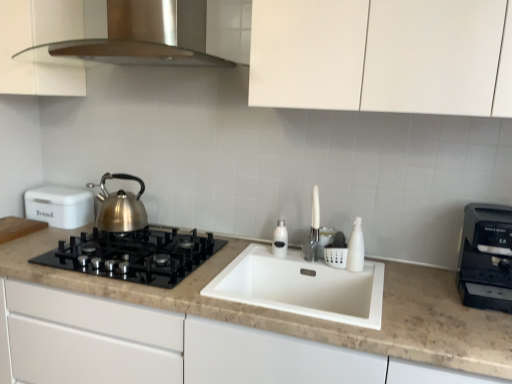
Question: Considering the positions of satin silver soap dispenser at sink, acting as the 2th bottle starting from the front, and black glass gas stove at left in the image, is satin silver soap dispenser at sink, acting as the 2th bottle starting from the front, bigger or smaller than black glass gas stove at left?

Choices:
 (A) small
 (B) big

Answer: (A)

Question: Is point (273, 251) closer or farther from the camera than point (95, 248)?

Choices:
 (A) closer
 (B) farther

Answer: (B)

Question: Which is nearer to the white matte bread bin at left, the first kitchen appliance from the back?

Choices:
 (A) satin silver range hood at upper center
 (B) brushed metal kettle at left
 (C) satin silver soap dispenser at sink, acting as the 2th bottle starting from the front
 (D) black glass gas stove at left
 (E) white plastic bottle at sink, the 1th bottle when ordered from right to left

Answer: (B)

Question: Which is farther from the white plastic bottle at sink, which ranks as the 1th bottle in front-to-back order?

Choices:
 (A) satin silver soap dispenser at sink, the 1th bottle in the left-to-right sequence
 (B) black plastic toaster at right, marked as the second kitchen appliance in a back-to-front arrangement
 (C) satin silver range hood at upper center
 (D) black glass gas stove at left
 (E) white matte bread bin at left, marked as the 2th kitchen appliance in a right-to-left arrangement

Answer: (E)